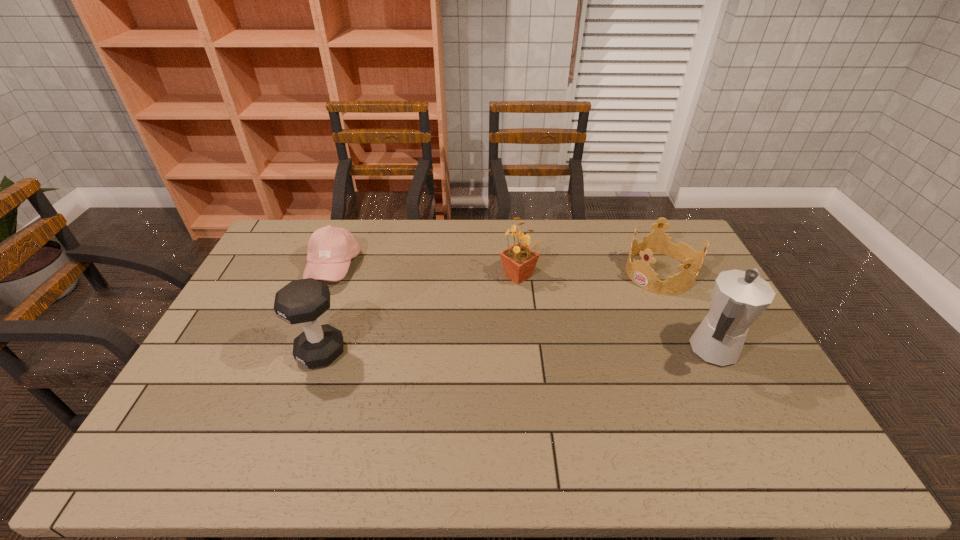
The image size is (960, 540). I want to click on free space located on the front-facing side of the tiara, so click(613, 302).

The image size is (960, 540). In order to click on vacant space located on the front-facing side of the tiara in this screenshot , I will do 629,292.

Find the location of a particular element. This screenshot has height=540, width=960. free space located 0.090m on the front-facing side of the tiara is located at coordinates (621, 297).

You are a GUI agent. You are given a task and a screenshot of the screen. Output one action in this format:
    pyautogui.click(x=<x>, y=<y>)
    Task: Click on the vacant space situated 0.170m at the front of the sunflower with flowers visible
    
    Given the screenshot: What is the action you would take?
    (x=517, y=327)

The image size is (960, 540). In order to click on free spot located 0.070m at the front of the sunflower with flowers visible in this screenshot , I will do click(517, 303).

This screenshot has height=540, width=960. I want to click on free region located at the front of the sunflower with flowers visible, so click(517, 381).

The width and height of the screenshot is (960, 540). I want to click on baseball cap situated at the far edge, so click(x=330, y=249).

I want to click on tiara that is at the far edge, so click(640, 272).

At what (x,y) coordinates should I click in order to perform the action: click on coffeepot at the right edge. Please return your answer as a coordinate pair (x, y). The width and height of the screenshot is (960, 540). Looking at the image, I should click on (739, 297).

What are the coordinates of `tiara that is at the right edge` in the screenshot? It's located at (640, 272).